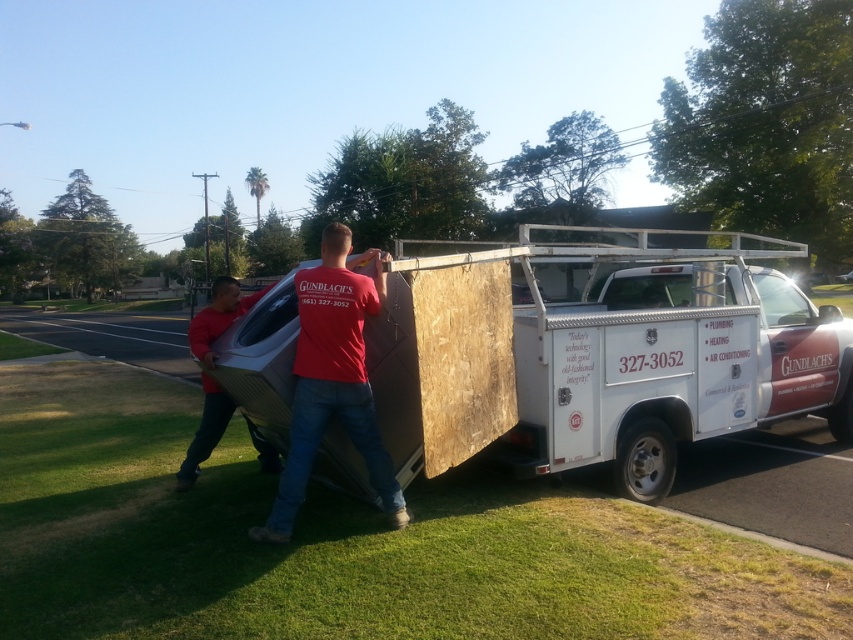
Which is above, white matte truck at center or red matte shirt at center?

white matte truck at center is higher up.

Based on the photo, does white matte truck at center appear on the right side of red matte shirt at center?

Yes, white matte truck at center is to the right of red matte shirt at center.

Identify the location of white matte truck at center. (598, 356).

Find the location of a particular element. This screenshot has width=853, height=640. white matte truck at center is located at coordinates (598, 356).

Who is more forward, (x=543, y=294) or (x=234, y=304)?

Point (x=234, y=304)

Is white matte truck at center in front of matte red shirt at center?

That is True.

Where is `white matte truck at center`? white matte truck at center is located at coordinates (598, 356).

Can you confirm if red matte shirt at center is positioned to the left of matte red shirt at center?

In fact, red matte shirt at center is to the right of matte red shirt at center.

Which of these two, red matte shirt at center or matte red shirt at center, stands taller?

matte red shirt at center is taller.

Who is more forward, (302, 456) or (189, 461)?

Point (302, 456) is in front.

Identify the location of red matte shirt at center. (334, 378).